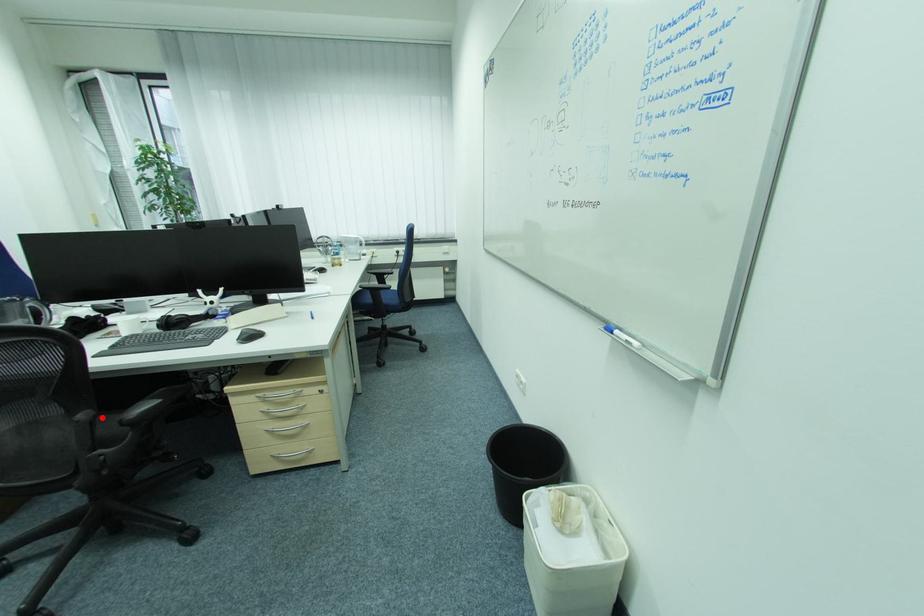
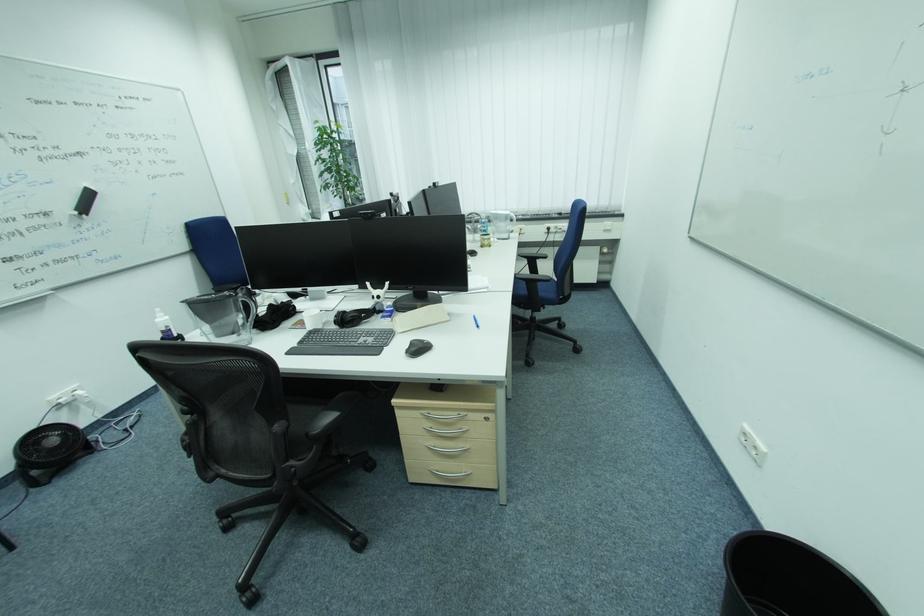
Question: I am providing you with two images of the same scene from different viewpoints. A red point is marked on the first image. Can you still see the location of the red point in image 2?

Choices:
 (A) Yes
 (B) No

Answer: (A)